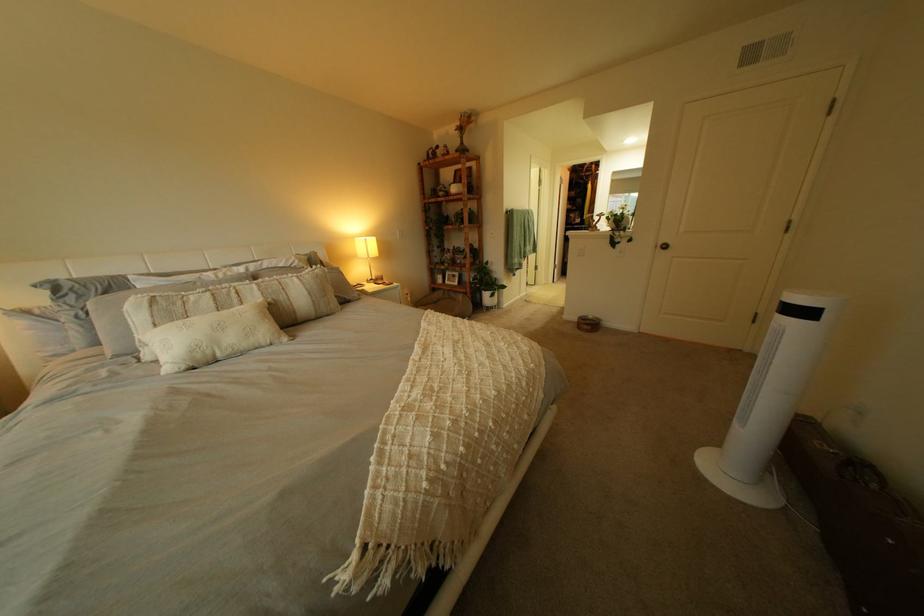
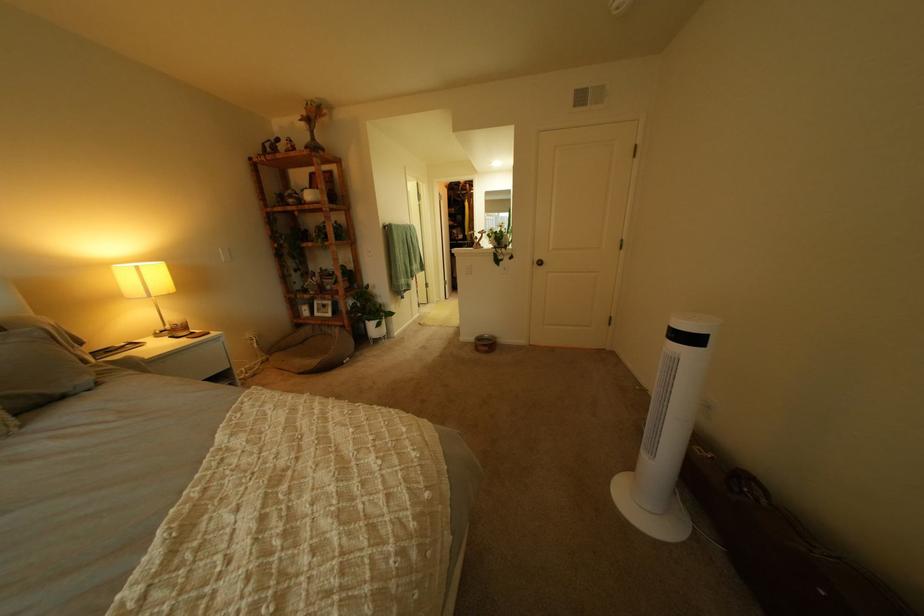
The point at (375,300) is marked in the first image. Where is the corresponding point in the second image?

(115, 385)